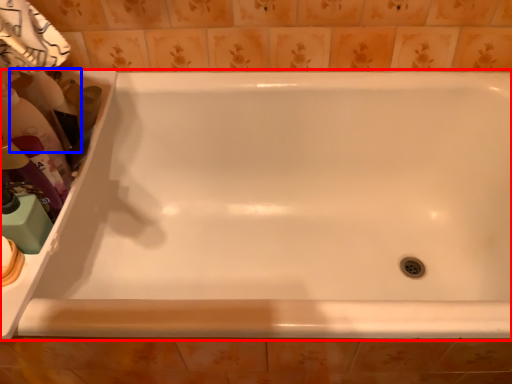
Question: Which object is closer to the camera taking this photo, bathtub (highlighted by a red box) or cleaning product (highlighted by a blue box)?

Choices:
 (A) bathtub
 (B) cleaning product

Answer: (A)